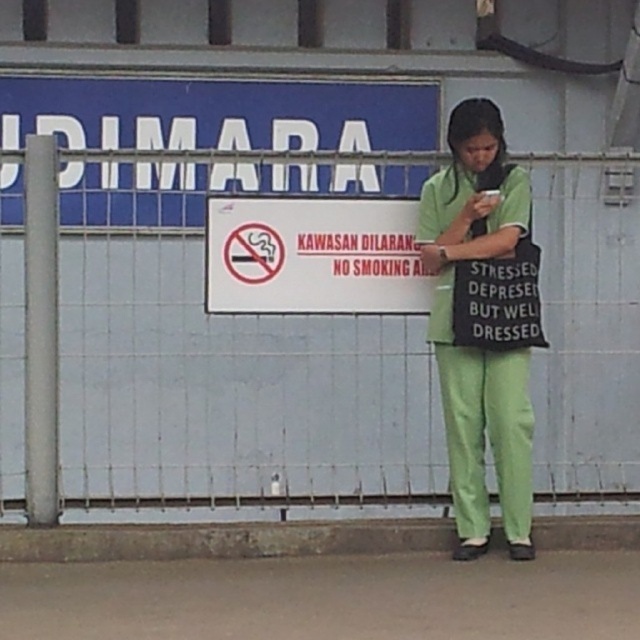
Question: Does metal wire fence at center have a larger size compared to white paper sign at center?

Choices:
 (A) yes
 (B) no

Answer: (A)

Question: In this image, where is metal wire fence at center located relative to green fabric bag at center?

Choices:
 (A) left
 (B) right

Answer: (A)

Question: Based on their relative distances, which object is farther from the white paper sign at center?

Choices:
 (A) green fabric bag at center
 (B) metal wire fence at center

Answer: (B)

Question: Which object appears farthest from the camera in this image?

Choices:
 (A) white paper sign at center
 (B) metal wire fence at center

Answer: (B)

Question: Which object is closer to the camera taking this photo?

Choices:
 (A) white paper sign at center
 (B) metal wire fence at center
 (C) green fabric bag at center

Answer: (C)

Question: Does metal wire fence at center have a greater width compared to green fabric bag at center?

Choices:
 (A) no
 (B) yes

Answer: (B)